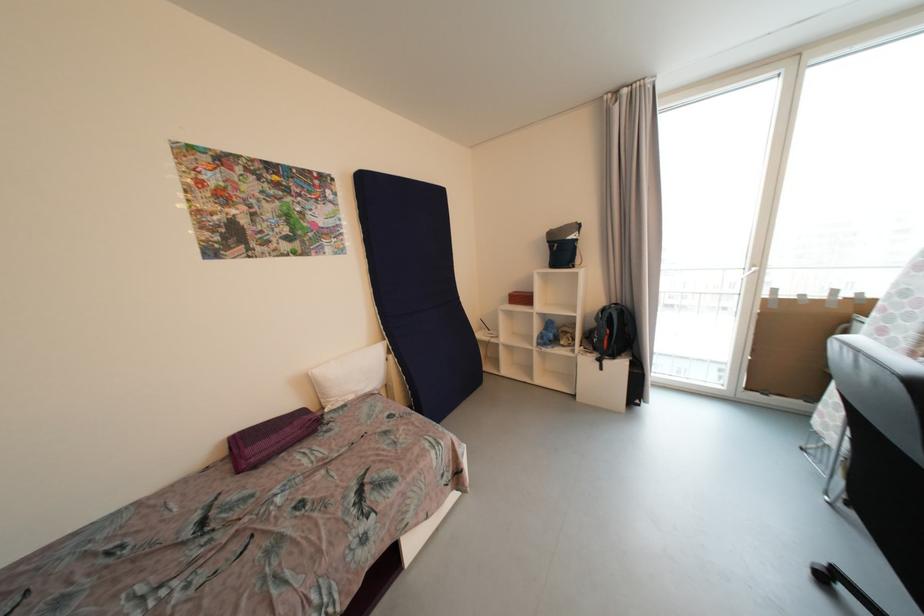
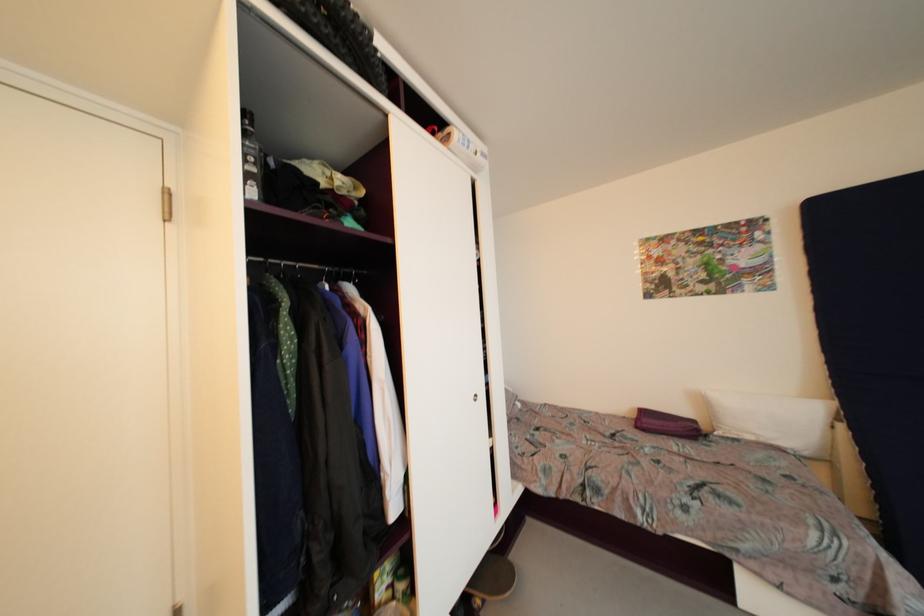
Question: The camera is either moving clockwise (left) or counter-clockwise (right) around the object. The first image is from the beginning of the video and the second image is from the end. Is the camera moving left or right when shooting the video?

Choices:
 (A) Left
 (B) Right

Answer: (B)